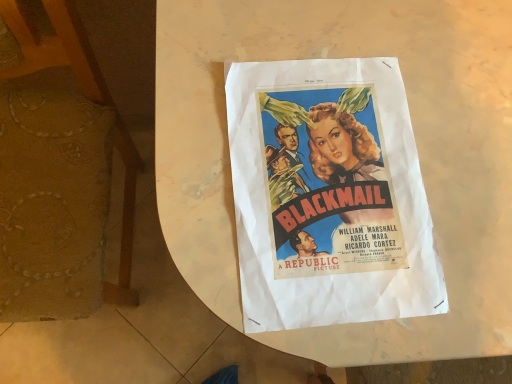
Question: Considering the positions of point [5, 289] and point [266, 157], is point [5, 289] closer or farther from the camera than point [266, 157]?

Choices:
 (A) farther
 (B) closer

Answer: (A)

Question: From the image's perspective, relative to matte paper poster at center, is wooden at left above or below?

Choices:
 (A) below
 (B) above

Answer: (B)

Question: In terms of size, does wooden at left appear bigger or smaller than matte paper poster at center?

Choices:
 (A) small
 (B) big

Answer: (B)

Question: Looking at their shapes, would you say matte paper poster at center is wider or thinner than wooden at left?

Choices:
 (A) wide
 (B) thin

Answer: (B)

Question: Is point (309, 284) positioned closer to the camera than point (53, 177)?

Choices:
 (A) farther
 (B) closer

Answer: (B)

Question: Do you think matte paper poster at center is within wooden at left, or outside of it?

Choices:
 (A) inside
 (B) outside

Answer: (B)

Question: In terms of height, does matte paper poster at center look taller or shorter compared to wooden at left?

Choices:
 (A) short
 (B) tall

Answer: (A)